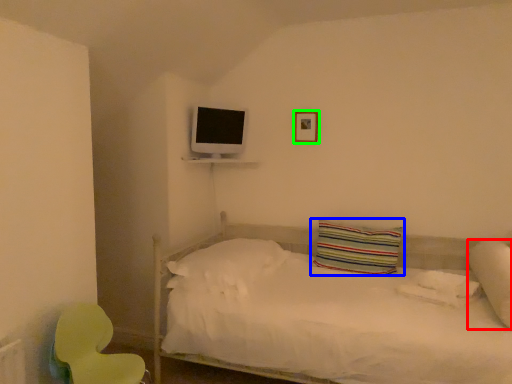
Question: Estimate the real-world distances between objects in this image. Which object is farther from pillow (highlighted by a red box), pillow (highlighted by a blue box) or picture frame (highlighted by a green box)?

Choices:
 (A) pillow
 (B) picture frame

Answer: (B)